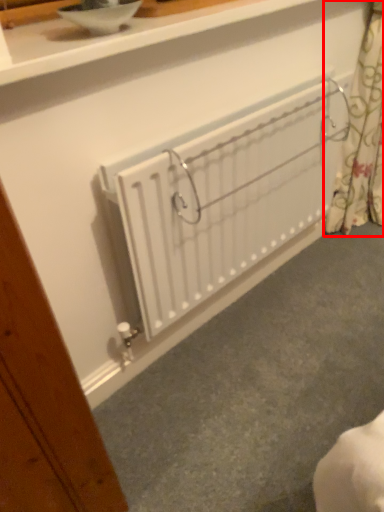
Question: From the image, what is the correct spatial relationship of curtain (annotated by the red box) in relation to radiator?

Choices:
 (A) left
 (B) right

Answer: (B)